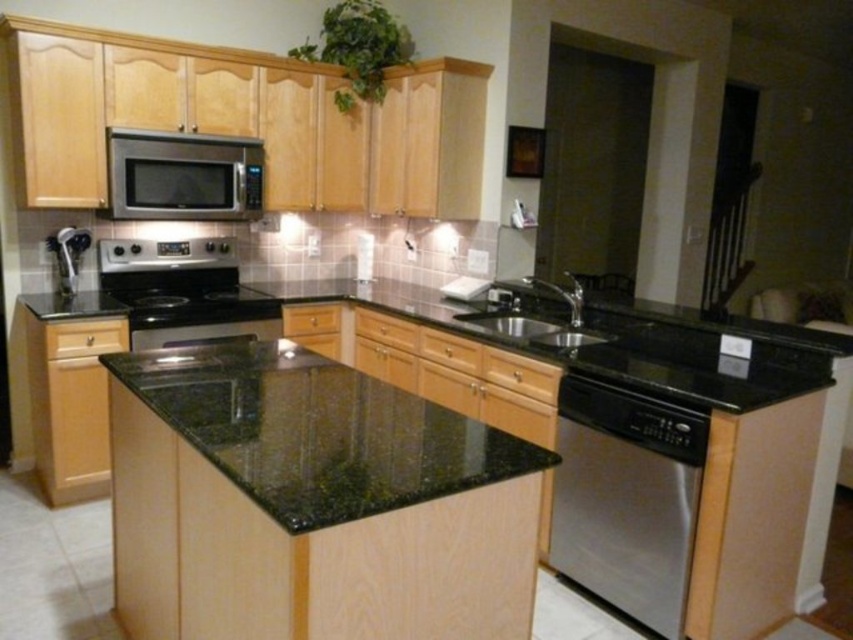
Question: Which of these objects is positioned closest to the satin black stove at center?

Choices:
 (A) black granite sink at center
 (B) satin stainless steel dishwasher at lower right

Answer: (A)

Question: Which is nearer to the satin stainless steel dishwasher at lower right?

Choices:
 (A) black granite sink at center
 (B) black granite countertop at center
 (C) black glass stove at center

Answer: (B)

Question: Is black granite countertop at center below black glass stove at center?

Choices:
 (A) no
 (B) yes

Answer: (B)

Question: Which point is closer to the camera?

Choices:
 (A) (711, 321)
 (B) (158, 342)

Answer: (A)

Question: Does stainless steel microwave at upper center appear on the left side of black granite sink at center?

Choices:
 (A) yes
 (B) no

Answer: (A)

Question: Is satin stainless steel dishwasher at lower right to the right of stainless steel microwave at upper center from the viewer's perspective?

Choices:
 (A) no
 (B) yes

Answer: (B)